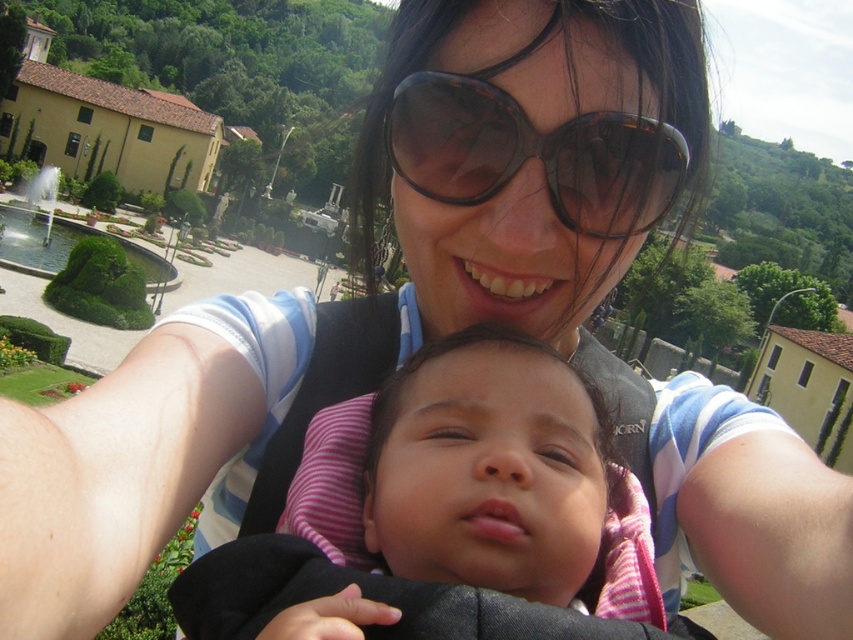
Which is in front, point (334, 406) or point (570, 195)?

Point (570, 195)

Is pink striped fabric at center shorter than tortoiseshell plastic goggles at center?

No.

You are a GUI agent. You are given a task and a screenshot of the screen. Output one action in this format:
    pyautogui.click(x=<x>, y=<y>)
    Task: Click on the pink striped fabric at center
    The height and width of the screenshot is (640, 853).
    Given the screenshot: What is the action you would take?
    pyautogui.click(x=480, y=480)